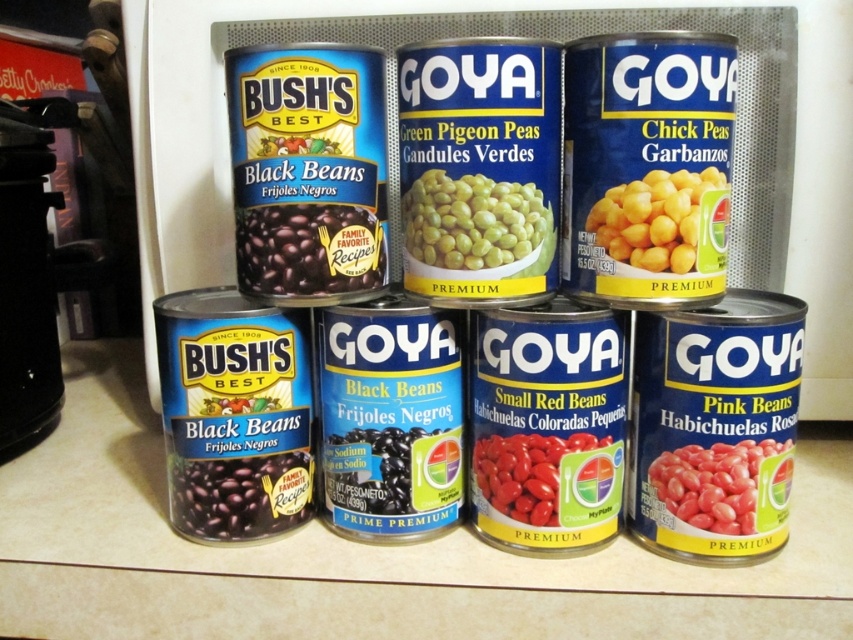
Question: Can you confirm if black matte/black beans at center is positioned to the left of yellow matte chick peas at center right?

Choices:
 (A) yes
 (B) no

Answer: (A)

Question: Which object appears closest to the camera in this image?

Choices:
 (A) pink matte beans at lower right
 (B) yellow matte chick peas at center right
 (C) black matte beans at center
 (D) black matte/black beans at center

Answer: (B)

Question: Does black matte/black beans at center have a greater width compared to black matte beans at center?

Choices:
 (A) yes
 (B) no

Answer: (A)

Question: Does matte black beans at lower left appear over yellow matte chick peas at center right?

Choices:
 (A) yes
 (B) no

Answer: (B)

Question: Which object is closer to the camera taking this photo?

Choices:
 (A) pink matte beans at lower right
 (B) green matte peas at center
 (C) matte black beans at lower left

Answer: (B)

Question: Which point appears closest to the camera in this image?

Choices:
 (A) (222, 508)
 (B) (691, 230)
 (C) (387, 470)
 (D) (258, 268)

Answer: (B)